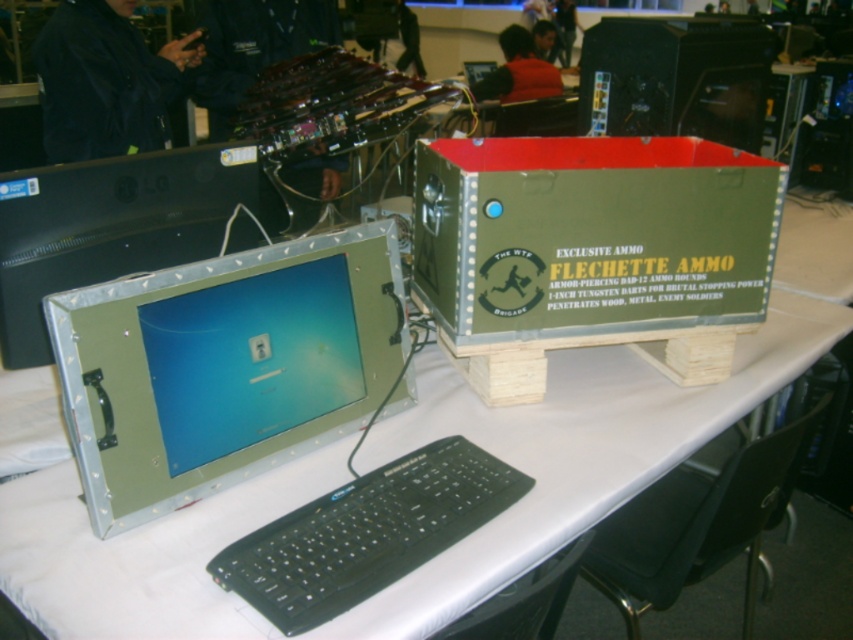
You are setting up a display for an event and need to place a large banner between the metallic green computer desk at center and the matte black desktop computer at upper right. Based on their sizes, which object should the banner be placed closer to for stability?

The metallic green computer desk at center is wider than the matte black desktop computer at upper right, so the banner should be placed closer to the metallic green computer desk at center for better stability.

You are setting up a booth at a tech event and need to place a black plastic keyboard exactly at coordinate point (366, 532). According to the scene description, is the current position of the black plastic keyboard at lower center already correctly placed at that coordinate?

Yes, the black plastic keyboard at lower center is located at point (366, 532), so it is correctly placed at the specified coordinate.

You are setting up a booth for a tech expo and need to position the black plastic keyboard at lower center and the matte black desktop computer at upper right. According to the setup guidelines, the keyboard must be placed to the right of the computer. Is the current arrangement compliant with the guidelines?

The black plastic keyboard at lower center is to the left of the matte black desktop computer at upper right, so the current arrangement is not compliant with the setup guidelines requiring the keyboard to be placed to the right of the computer.